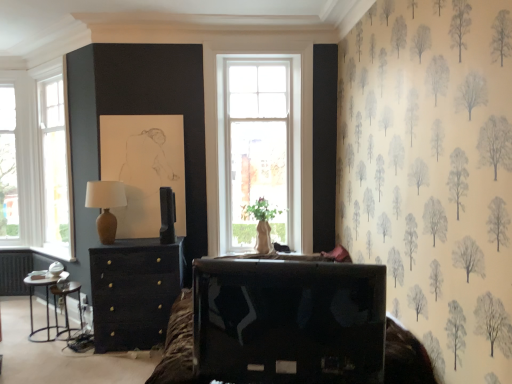
Question: Is matte brown table lamp at left a part of metallic silver side table at lower left?

Choices:
 (A) no
 (B) yes

Answer: (A)

Question: Is metallic silver side table at lower left taller than matte brown table lamp at left?

Choices:
 (A) no
 (B) yes

Answer: (A)

Question: Is metallic silver side table at lower left looking in the opposite direction of matte brown table lamp at left?

Choices:
 (A) yes
 (B) no

Answer: (B)

Question: From a real-world perspective, is metallic silver side table at lower left below matte brown table lamp at left?

Choices:
 (A) no
 (B) yes

Answer: (B)

Question: Does metallic silver side table at lower left have a lesser width compared to matte brown table lamp at left?

Choices:
 (A) no
 (B) yes

Answer: (A)

Question: From their relative heights in the image, would you say shiny black tv at lower center is taller or shorter than white glass window at left?

Choices:
 (A) short
 (B) tall

Answer: (A)

Question: From a real-world perspective, is shiny black tv at lower center above or below white glass window at left?

Choices:
 (A) below
 (B) above

Answer: (A)

Question: Is point (288, 332) positioned closer to the camera than point (60, 251)?

Choices:
 (A) farther
 (B) closer

Answer: (B)

Question: Is shiny black tv at lower center inside or outside of white glass window at left?

Choices:
 (A) inside
 (B) outside

Answer: (B)

Question: Is metallic silver side table at lower left wider or thinner than metallic black side table at lower left?

Choices:
 (A) wide
 (B) thin

Answer: (B)

Question: Considering the positions of point (57, 336) and point (35, 276), is point (57, 336) closer or farther from the camera than point (35, 276)?

Choices:
 (A) farther
 (B) closer

Answer: (B)

Question: In the image, is metallic silver side table at lower left positioned in front of or behind metallic black side table at lower left?

Choices:
 (A) behind
 (B) front

Answer: (A)

Question: From a real-world perspective, is metallic silver side table at lower left above or below metallic black side table at lower left?

Choices:
 (A) above
 (B) below

Answer: (B)

Question: Considering their positions, is matte brown table lamp at left located in front of or behind matte black chest of drawers at center?

Choices:
 (A) front
 (B) behind

Answer: (A)

Question: Looking at the image, does matte brown table lamp at left seem bigger or smaller compared to matte black chest of drawers at center?

Choices:
 (A) big
 (B) small

Answer: (B)